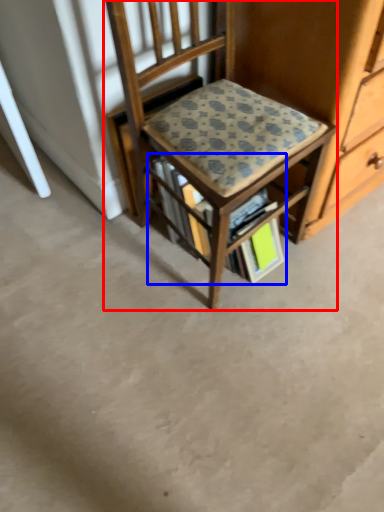
Question: Which point is further to the camera, chair (highlighted by a red box) or book (highlighted by a blue box)?

Choices:
 (A) chair
 (B) book

Answer: (B)